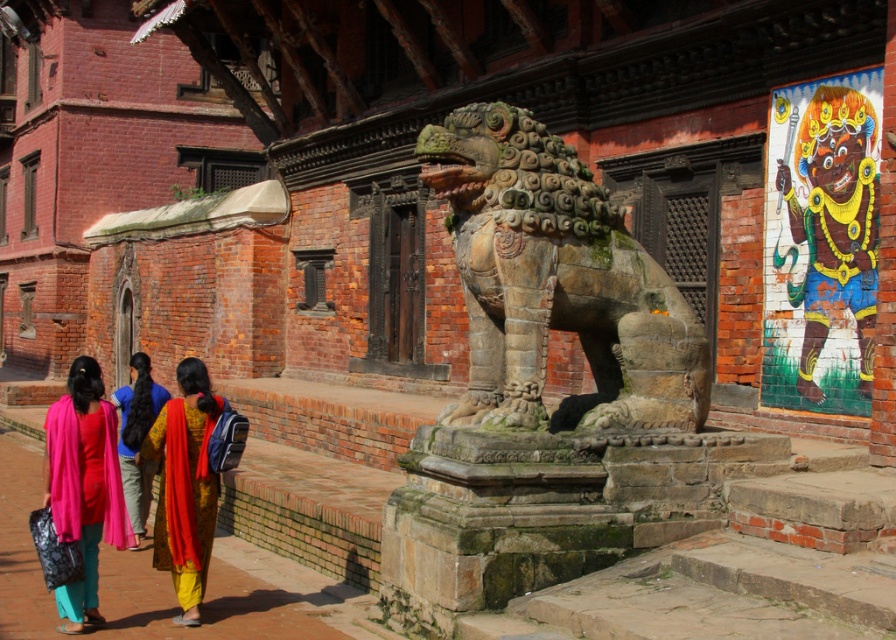
Question: Among these points, which one is farthest from the camera?

Choices:
 (A) coord(108,500)
 (B) coord(186,468)
 (C) coord(535,417)
 (D) coord(873,115)

Answer: (D)

Question: Observing the image, what is the correct spatial positioning of multicolored painted deity at upper right in reference to vivid pink fabric at lower left?

Choices:
 (A) left
 (B) right

Answer: (B)

Question: Which of these objects is positioned farthest from the matte pink scarf at lower left?

Choices:
 (A) yellow silk saree at center
 (B) vivid pink fabric at lower left

Answer: (B)

Question: Is multicolored painted deity at upper right thinner than matte pink scarf at lower left?

Choices:
 (A) no
 (B) yes

Answer: (B)

Question: Which point is farther to the camera?

Choices:
 (A) green stone lion at center
 (B) vivid pink fabric at lower left
 (C) matte pink scarf at lower left
 (D) yellow silk saree at center

Answer: (B)

Question: Does multicolored painted deity at upper right have a lesser width compared to vivid pink fabric at lower left?

Choices:
 (A) no
 (B) yes

Answer: (B)